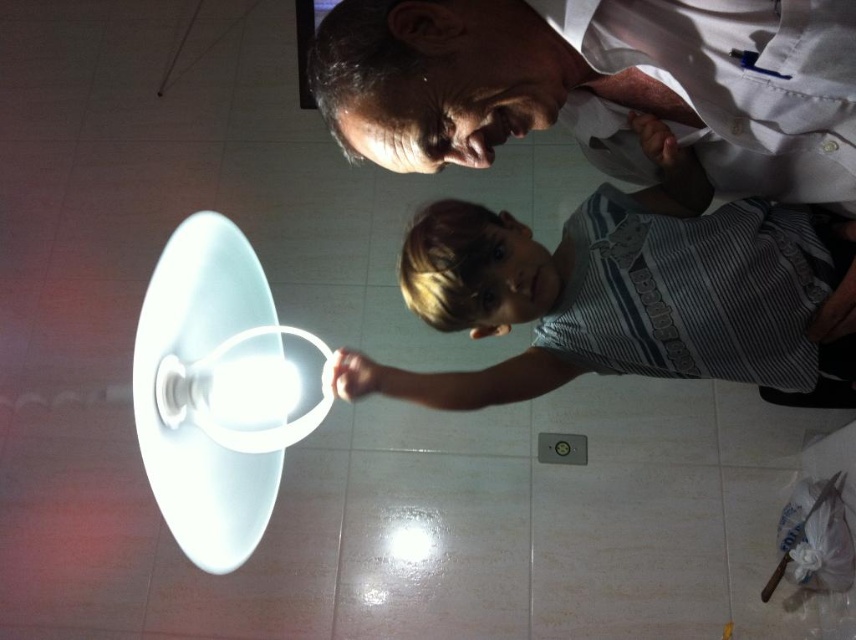
You are standing in the room and want to find the white shirt at upper center. According to the coordinates provided, where should you look?

The white shirt at upper center is located at point 0.123 in the x coordinate and 0.699 in the y coordinate.

In the scene, you see two people wearing a white shirt at upper center and a striped cotton shirt at center. Which person is positioned to the left of the other?

The white shirt at upper center is to the left of striped cotton shirt at center.

You are standing in the room with the large white dome lamp. You see two points marked in the image. The first point is at coordinates point (183, 292) and the second point is at point (845, 404). Which point is closer to you?

Point (183, 292) is closer to you because it is further to the camera than point (845, 404).